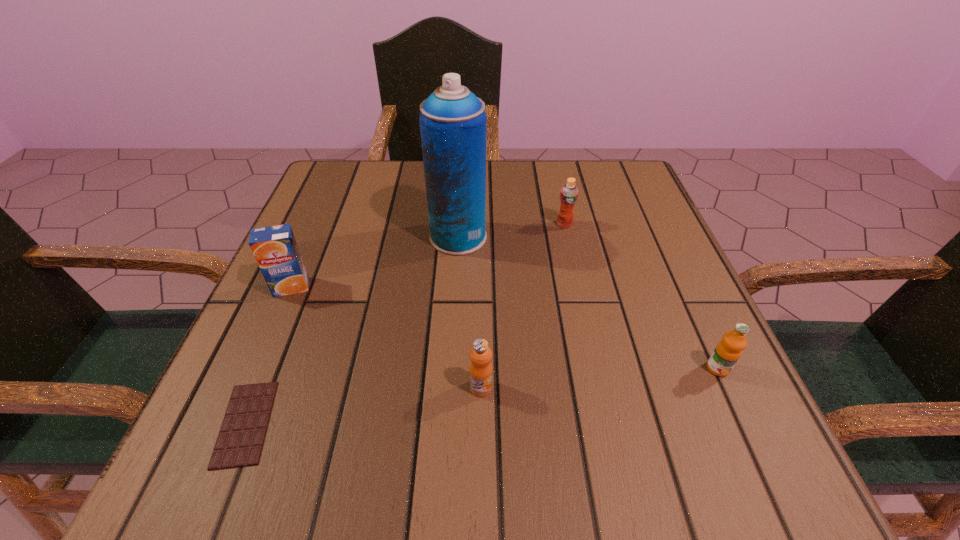
Locate an element on the screen. Image resolution: width=960 pixels, height=540 pixels. vacant area at the far edge is located at coordinates (547, 176).

This screenshot has width=960, height=540. Find the location of `free location at the near edge of the desktop`. free location at the near edge of the desktop is located at coordinates (557, 446).

Locate an element on the screen. This screenshot has height=540, width=960. free space at the left edge of the desktop is located at coordinates (257, 332).

In order to click on vacant space at the right edge of the desktop in this screenshot , I will do `click(649, 340)`.

Locate an element on the screen. vacant position at the far left corner of the desktop is located at coordinates (354, 206).

Locate an element on the screen. This screenshot has height=540, width=960. vacant space at the far right corner of the desktop is located at coordinates (624, 200).

Where is `free area in between the second orange juice from left to right and the aerosol can`? The width and height of the screenshot is (960, 540). free area in between the second orange juice from left to right and the aerosol can is located at coordinates (469, 312).

Identify the location of vacant space in between the third nearest object and the fourth nearest object. (504, 328).

Image resolution: width=960 pixels, height=540 pixels. I want to click on vacant area that lies between the chocolate bar and the farthest orange juice, so click(405, 323).

The image size is (960, 540). Find the location of `vacant area between the nearest orange juice and the leftmost orange juice`. vacant area between the nearest orange juice and the leftmost orange juice is located at coordinates (386, 337).